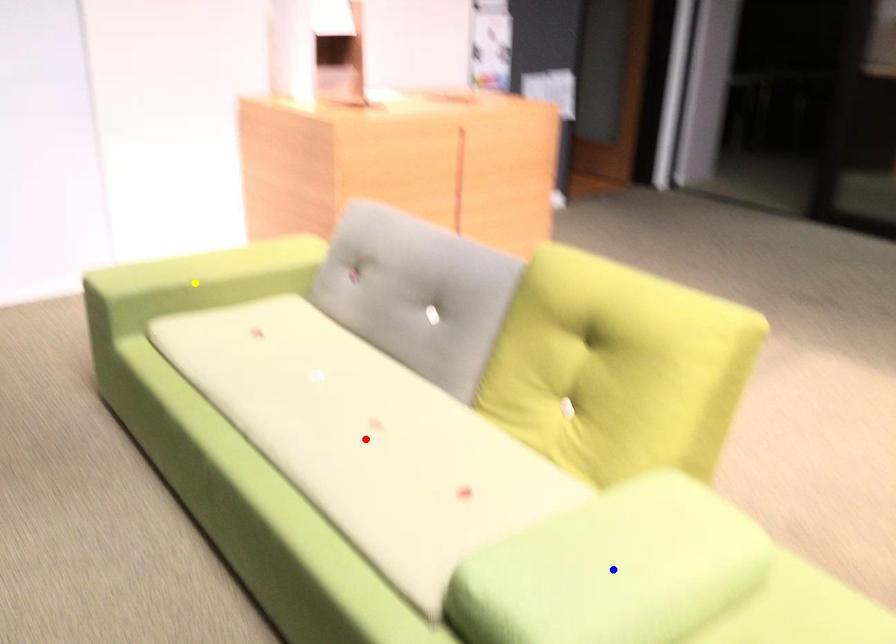
Order these from nearest to farthest:
- blue point
- yellow point
- red point

1. blue point
2. red point
3. yellow point